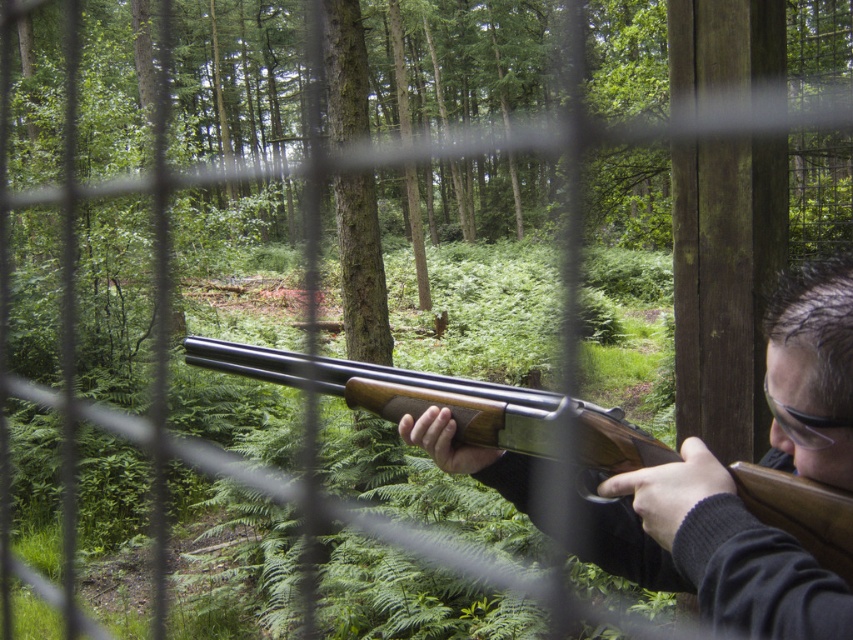
Question: Can you confirm if wooden shotgun at center is positioned to the right of clear plastic goggles at upper right?

Choices:
 (A) yes
 (B) no

Answer: (B)

Question: Observing the image, what is the correct spatial positioning of wooden shotgun at center in reference to clear plastic goggles at upper right?

Choices:
 (A) above
 (B) below

Answer: (B)

Question: Is wooden shotgun at center to the right of clear plastic goggles at upper right from the viewer's perspective?

Choices:
 (A) no
 (B) yes

Answer: (A)